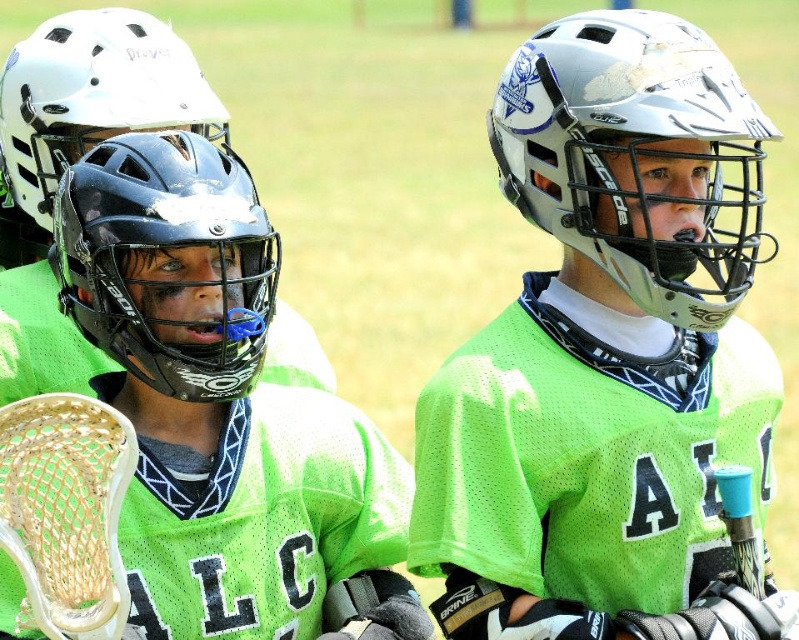
Can you confirm if white matte helmet at center is wider than black matte helmet at center?

Yes.

Which is in front, point (732, 236) or point (86, 246)?

Positioned in front is point (86, 246).

Identify the location of white matte helmet at center. The height and width of the screenshot is (640, 799). (633, 154).

Between black matte helmet at center and white matte helmet at upper left, which one is positioned lower?

black matte helmet at center is below.

Does black matte helmet at center appear over white matte helmet at upper left?

No.

Is point (110, 333) in front of point (42, 113)?

Yes, it is.

Image resolution: width=799 pixels, height=640 pixels. I want to click on black matte helmet at center, so click(165, 250).

Between white matte helmet at center and white matte helmet at upper left, which one appears on the left side from the viewer's perspective?

white matte helmet at upper left is more to the left.

Which of these two, white matte helmet at center or white matte helmet at upper left, stands shorter?

white matte helmet at upper left is shorter.

Between point (513, 173) and point (100, 65), which one is positioned behind?

The point (100, 65) is behind.

The height and width of the screenshot is (640, 799). Identify the location of white matte helmet at center. (633, 154).